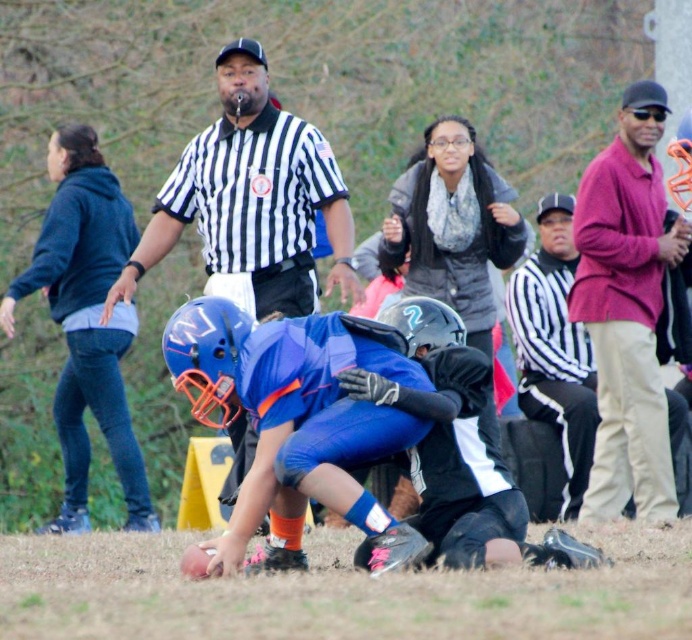
Does black striped shirt at center have a smaller size compared to matte pink shirt at right?

No.

This screenshot has width=692, height=640. In order to click on black striped shirt at center in this screenshot , I will do `click(251, 200)`.

The height and width of the screenshot is (640, 692). What do you see at coordinates (251, 200) in the screenshot?
I see `black striped shirt at center` at bounding box center [251, 200].

At what (x,y) coordinates should I click in order to perform the action: click on black striped shirt at center. Please return your answer as a coordinate pair (x, y). Image resolution: width=692 pixels, height=640 pixels. Looking at the image, I should click on (251, 200).